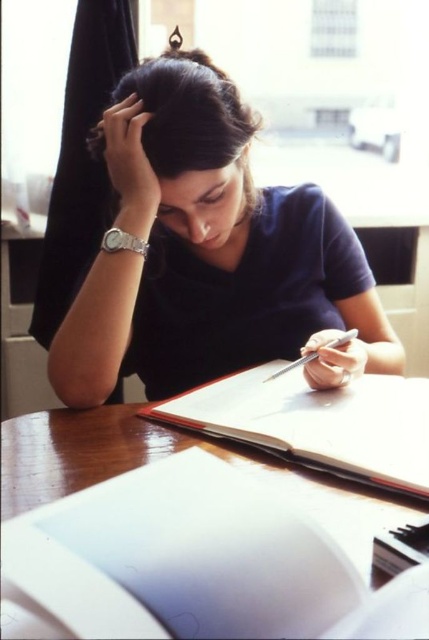
Is dark blue shirt at center wider than white paper notebook at center?

Correct, the width of dark blue shirt at center exceeds that of white paper notebook at center.

Looking at this image, does dark blue shirt at center appear on the left side of white paper notebook at center?

Indeed, dark blue shirt at center is positioned on the left side of white paper notebook at center.

Find the location of `dark blue shirt at center`. dark blue shirt at center is located at coordinates (208, 252).

Find the location of a particular element. dark blue shirt at center is located at coordinates (208, 252).

Between wooden table at center and white paper notebook at center, which one is positioned higher?

Positioned higher is white paper notebook at center.

This screenshot has height=640, width=429. Describe the element at coordinates (199, 561) in the screenshot. I see `wooden table at center` at that location.

Describe the element at coordinates (199, 561) in the screenshot. I see `wooden table at center` at that location.

Find the location of a particular element. wooden table at center is located at coordinates (199, 561).

Can you confirm if dark blue shirt at center is positioned below wooden table at center?

No, dark blue shirt at center is not below wooden table at center.

Can you confirm if dark blue shirt at center is taller than wooden table at center?

Correct, dark blue shirt at center is much taller as wooden table at center.

Who is more forward, (329, 307) or (417, 598)?

Point (417, 598) is more forward.

Find the location of a particular element. The image size is (429, 640). dark blue shirt at center is located at coordinates (208, 252).